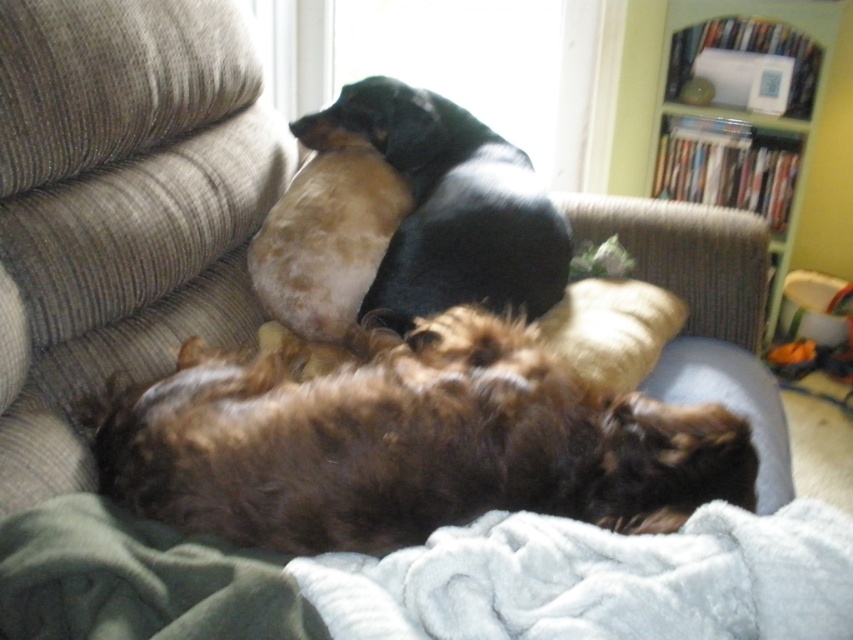
Question: Which of the following is the closest to the observer?

Choices:
 (A) black smooth dog at upper center
 (B) green plastic bookshelf at upper right
 (C) soft blue blanket at lower center

Answer: (C)

Question: Is brown shaggy dog at center wider than soft blue blanket at lower center?

Choices:
 (A) no
 (B) yes

Answer: (A)

Question: Among these objects, which one is farthest from the camera?

Choices:
 (A) soft yellow pillow at center
 (B) black smooth dog at upper center
 (C) green plastic bookshelf at upper right
 (D) soft blue blanket at lower center

Answer: (C)

Question: Is soft blue blanket at lower center behind soft yellow pillow at center?

Choices:
 (A) yes
 (B) no

Answer: (B)

Question: Does black smooth dog at upper center have a lesser width compared to soft yellow pillow at center?

Choices:
 (A) no
 (B) yes

Answer: (A)

Question: Considering the real-world distances, which object is farthest from the soft yellow pillow at center?

Choices:
 (A) soft blue blanket at lower center
 (B) brown shaggy dog at center
 (C) black smooth dog at upper center

Answer: (A)